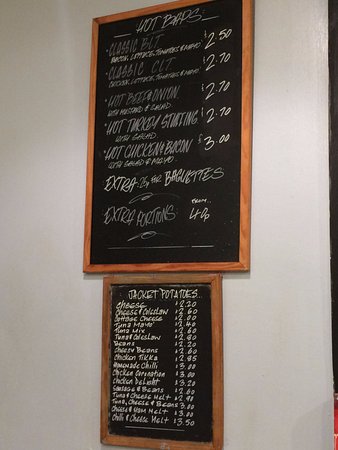
Locate an element on the screen. The image size is (338, 450). chalkboards is located at coordinates (208, 357), (224, 237).